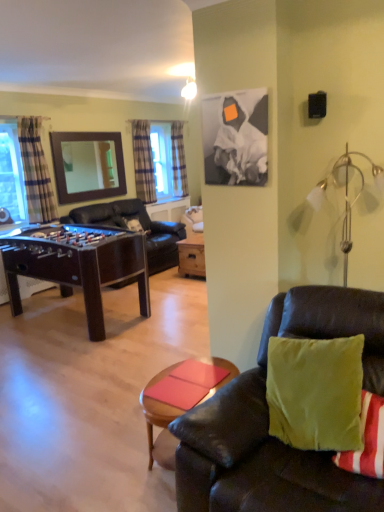
Question: In terms of size, does wooden mirror at upper left appear bigger or smaller than white glass lamp at upper right?

Choices:
 (A) small
 (B) big

Answer: (A)

Question: Is wooden mirror at upper left spatially inside white glass lamp at upper right, or outside of it?

Choices:
 (A) outside
 (B) inside

Answer: (A)

Question: Estimate the real-world distances between objects in this image. Which object is closer to the smooth wooden coffee table at lower center?

Choices:
 (A) velvet green couch at lower right, the first studio couch in the front-to-back sequence
 (B) wooden mirror at upper left
 (C) dark brown leather couch at center, positioned as the first studio couch in top-to-bottom order
 (D) mahogany wood foosball table at left
 (E) clear glass window at left

Answer: (A)

Question: Based on their relative distances, which object is nearer to the plaid fabric curtain at upper left, which is the 1th curtain from right to left?

Choices:
 (A) smooth wooden coffee table at lower center
 (B) velvet green couch at lower right, the second studio couch when ordered from top to bottom
 (C) mahogany wood foosball table at left
 (D) plaid fabric curtain at center, marked as the second curtain in a front-to-back arrangement
 (E) clear glass window at left

Answer: (D)